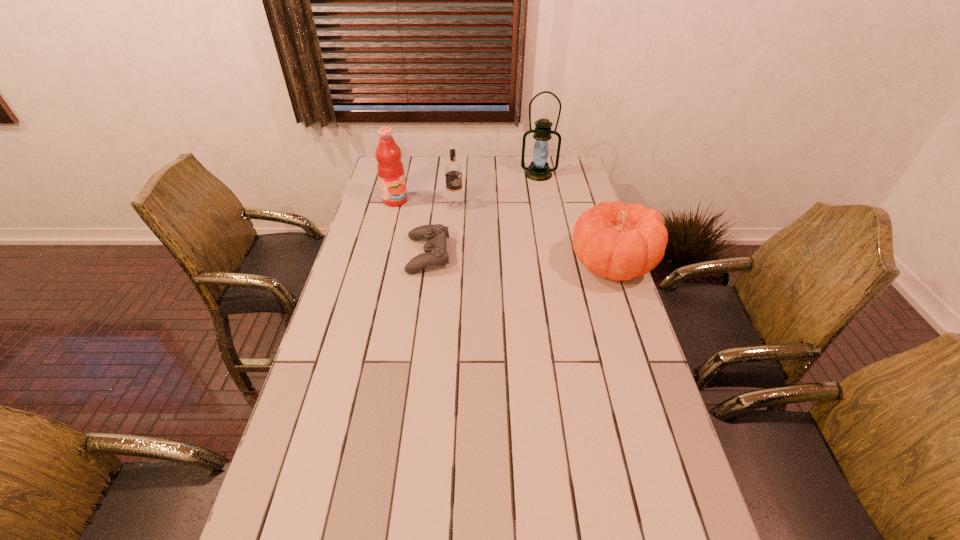
You are a GUI agent. You are given a task and a screenshot of the screen. Output one action in this format:
    pyautogui.click(x=<x>, y=<y>)
    Task: Click on the free space on the desktop that is between the shortest object and the pumpkin and is positioned on the front label of the leftmost object
    The width and height of the screenshot is (960, 540).
    Given the screenshot: What is the action you would take?
    pyautogui.click(x=531, y=260)

Image resolution: width=960 pixels, height=540 pixels. What are the coordinates of `vacant space on the desktop that is between the control and the pumpkin and is positioned on the side where the lantern emits light` in the screenshot? It's located at [x=536, y=260].

The height and width of the screenshot is (540, 960). What are the coordinates of `free space on the desktop that is between the control and the second shortest object and is positioned on the label of the third tallest object` in the screenshot? It's located at (536, 260).